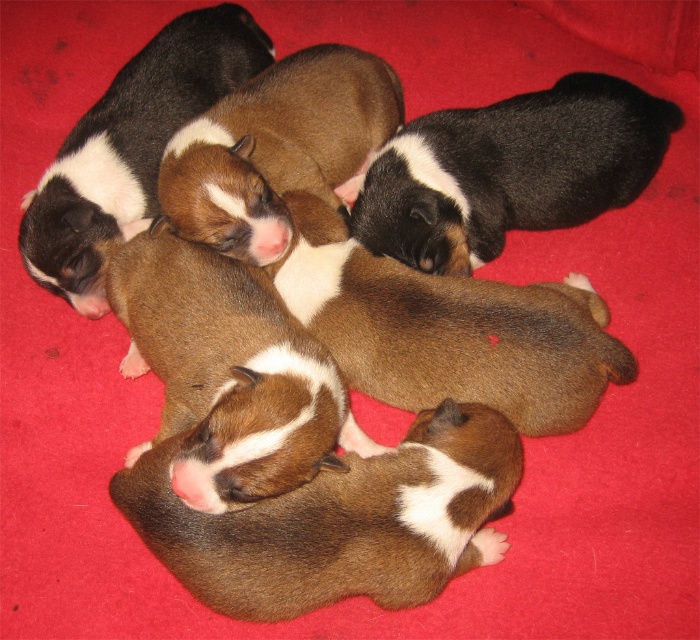
You are a photographer trying to capture a closeup shot of the black fur puppy at upper right and the brown fur puppy at upper left. Given that your camera can only focus on one puppy at a time, which puppy should you choose to ensure the subject is fully within the frame if the camera has a fixed width limit?

The black fur puppy at upper right should be chosen because its width is larger than the brown fur puppy at upper left, making it more likely to fit within the camera frame if the camera has a fixed width limit.

You are a photographer trying to capture a closeup shot of the black fur puppy at upper right and the brown fur puppy at upper left. Since the puppies are very close to each other, you want to ensure you can focus on both. Given their sizes, which puppy might require you to adjust your camera focus more carefully to ensure clarity?

The black fur puppy at upper right is not as tall as the brown fur puppy at upper left, so you may need to adjust your camera focus more carefully on the black fur puppy at upper right to ensure clarity since it is smaller in height compared to the brown fur puppy at upper left.

You are a photographer trying to capture a closeup of both the brown furry puppy at center and the brown soft fur puppy at center. Since your camera can only focus on one subject at a time, which puppy should you choose to ensure the photo isn not blurry due to size differences?

The brown furry puppy at center is larger in width than the brown soft fur puppy at center, so focusing on the larger one might be easier to capture a clear image without blurriness caused by size differences.